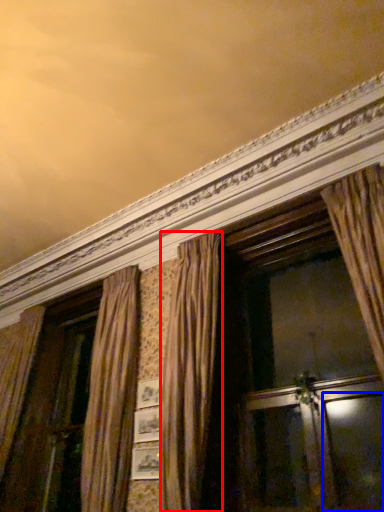
Question: Which of the following is the closest to the observer, curtain (highlighted by a red box) or screen door (highlighted by a blue box)?

Choices:
 (A) curtain
 (B) screen door

Answer: (B)